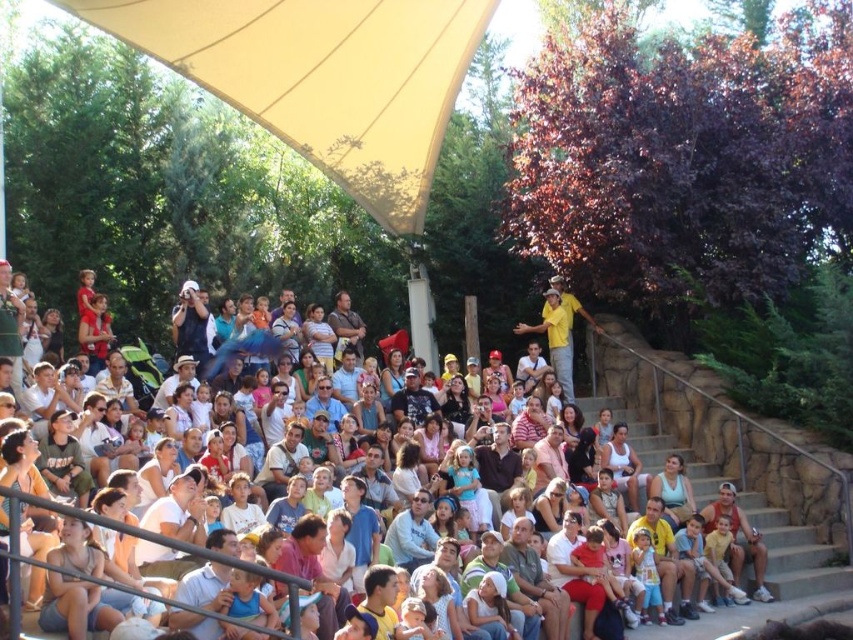
You are a photographer at the event and want to take a photo of the matte black shirt at center without the beige fabric canopy at upper left blocking the view. Is this possible?

The beige fabric canopy at upper left is located above the matte black shirt at center, so it will block the view. To avoid the canopy, position yourself below or to the side where the canopy isn not obstructing the shirt.

You are a photographer at the event and need to frame a shot that includes both the beige fabric canopy at upper left and the matte white crowd at center. Which object should you position wider in your camera frame?

The beige fabric canopy at upper left should be positioned wider in your camera frame since its width surpasses that of the matte white crowd at center.

You are attending an outdoor event and notice the beige fabric canopy at upper left and the matte black shirt at center. From your perspective, which object is positioned further to the left?

The beige fabric canopy at upper left is positioned further to the left compared to the matte black shirt at center.